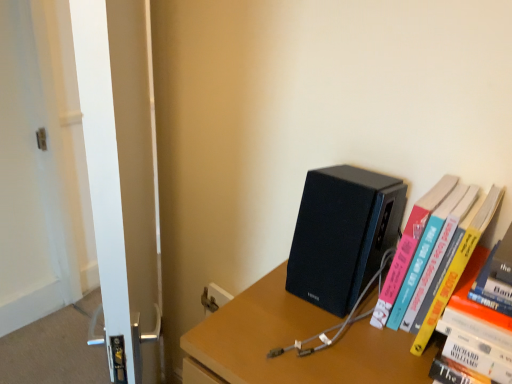
Question: Is matte black speaker at upper right aimed at black matte speaker at center-right?

Choices:
 (A) yes
 (B) no

Answer: (B)

Question: From a real-world perspective, does matte black speaker at upper right sit lower than black matte speaker at center-right?

Choices:
 (A) no
 (B) yes

Answer: (B)

Question: From the image's perspective, is matte black speaker at upper right below black matte speaker at center-right?

Choices:
 (A) yes
 (B) no

Answer: (A)

Question: Is matte black speaker at upper right further to camera compared to black matte speaker at center-right?

Choices:
 (A) yes
 (B) no

Answer: (B)

Question: From a real-world perspective, is matte black speaker at upper right on black matte speaker at center-right?

Choices:
 (A) no
 (B) yes

Answer: (A)

Question: From a real-world perspective, is white glossy screen door at left physically located above or below matte black speaker at upper right?

Choices:
 (A) below
 (B) above

Answer: (B)

Question: From the image's perspective, is white glossy screen door at left positioned above or below matte black speaker at upper right?

Choices:
 (A) above
 (B) below

Answer: (A)

Question: Looking at the image, does white glossy screen door at left seem bigger or smaller compared to matte black speaker at upper right?

Choices:
 (A) big
 (B) small

Answer: (A)

Question: In the image, is white glossy screen door at left on the left side or the right side of matte black speaker at upper right?

Choices:
 (A) left
 (B) right

Answer: (A)

Question: In the image, is white glossy screen door at left on the left side or the right side of hardcover book at right?

Choices:
 (A) right
 (B) left

Answer: (B)

Question: Is point (143, 6) closer or farther from the camera than point (460, 244)?

Choices:
 (A) closer
 (B) farther

Answer: (B)

Question: Relative to hardcover book at right, is white glossy screen door at left in front or behind?

Choices:
 (A) behind
 (B) front

Answer: (B)

Question: In terms of size, does white glossy screen door at left appear bigger or smaller than hardcover book at right?

Choices:
 (A) big
 (B) small

Answer: (A)

Question: In the image, is hardcover book at right positioned in front of or behind matte black speaker at upper right?

Choices:
 (A) behind
 (B) front

Answer: (A)

Question: Looking at their shapes, would you say hardcover book at right is wider or thinner than matte black speaker at upper right?

Choices:
 (A) wide
 (B) thin

Answer: (B)